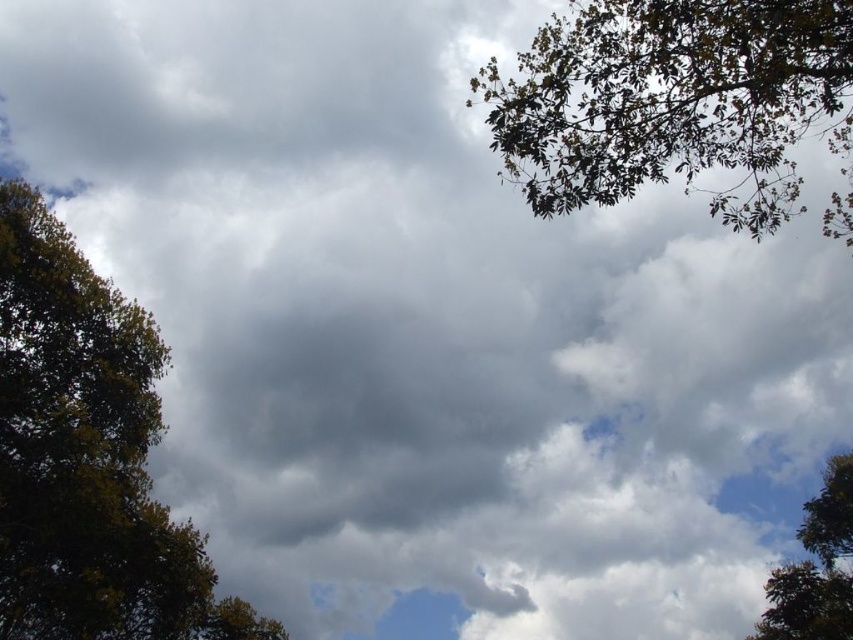
Does green leafy branches at upper right appear on the right side of green leafy tree at lower right?

Incorrect, green leafy branches at upper right is not on the right side of green leafy tree at lower right.

Can you confirm if green leafy branches at upper right is positioned above green leafy tree at lower right?

Yes.

Between point (722, 92) and point (840, 636), which one is positioned behind?

The point (840, 636) is more distant.

I want to click on green leafy branches at upper right, so click(x=672, y=100).

Does green leafy tree at left have a lesser width compared to green leafy tree at lower right?

No, green leafy tree at left is not thinner than green leafy tree at lower right.

Who is lower down, green leafy tree at left or green leafy tree at lower right?

green leafy tree at lower right is below.

Between point (119, 630) and point (817, 554), which one is positioned in front?

Point (119, 630)

You are a GUI agent. You are given a task and a screenshot of the screen. Output one action in this format:
    pyautogui.click(x=<x>, y=<y>)
    Task: Click on the green leafy tree at left
    
    Given the screenshot: What is the action you would take?
    pyautogui.click(x=88, y=456)

Which of these two, green leafy tree at left or green leafy branches at upper right, stands shorter?

green leafy branches at upper right

Does green leafy tree at left have a larger size compared to green leafy branches at upper right?

Incorrect, green leafy tree at left is not larger than green leafy branches at upper right.

Between point (51, 272) and point (692, 100), which one is positioned in front?

Point (692, 100)

Where is `green leafy tree at left`? green leafy tree at left is located at coordinates (88, 456).